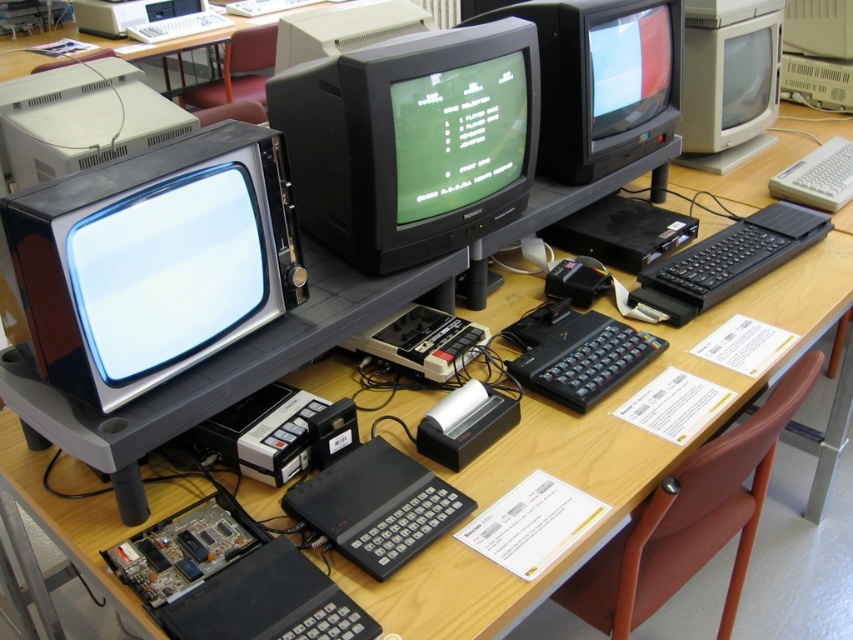
Question: Which is nearer to the white plastic printer at upper center?

Choices:
 (A) matte black monitor at left
 (B) white plastic keyboard at upper center

Answer: (A)

Question: Among these points, which one is farthest from the camera?

Choices:
 (A) (199, 32)
 (B) (383, 92)
 (C) (810, 188)

Answer: (A)

Question: Is matte black monitor at left below matte gray monitor at upper right?

Choices:
 (A) no
 (B) yes

Answer: (B)

Question: Which of the following is the farthest from the observer?

Choices:
 (A) matte gray desktop computer at upper left
 (B) matte black monitor at left
 (C) white plastic printer at upper center

Answer: (C)

Question: Is matte black monitor at center positioned behind white plastic keyboard at right?

Choices:
 (A) yes
 (B) no

Answer: (B)

Question: Observing the image, what is the correct spatial positioning of black plastic monitor at center in reference to white plastic keyboard at upper center?

Choices:
 (A) left
 (B) right

Answer: (B)